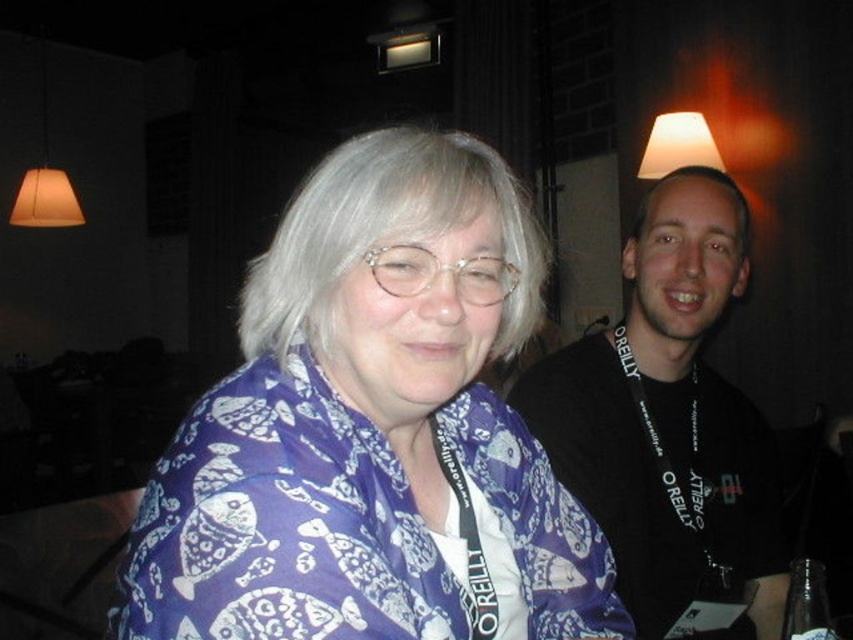
Is purple printed scarf at center below wooden table at lower left?

No, purple printed scarf at center is not below wooden table at lower left.

Can you confirm if purple printed scarf at center is bigger than wooden table at lower left?

Indeed, purple printed scarf at center has a larger size compared to wooden table at lower left.

Which is behind, point (495, 589) or point (24, 572)?

The point (24, 572) is behind.

Locate an element on the screen. This screenshot has height=640, width=853. purple printed scarf at center is located at coordinates (373, 429).

Consider the image. Can you confirm if black lanyard at right is positioned to the left of matte white lampshade at upper center?

Indeed, black lanyard at right is positioned on the left side of matte white lampshade at upper center.

Is point (730, 243) positioned after point (643, 177)?

No, (730, 243) is in front of (643, 177).

Describe the element at coordinates (669, 420) in the screenshot. The height and width of the screenshot is (640, 853). I see `black lanyard at right` at that location.

Where is `black lanyard at right`? The height and width of the screenshot is (640, 853). black lanyard at right is located at coordinates (669, 420).

Does point (10, 211) lie behind point (660, 173)?

Yes, point (10, 211) is farther from viewer.

Does matte orange lampshade at upper left have a greater height compared to matte white lampshade at upper center?

Correct, matte orange lampshade at upper left is much taller as matte white lampshade at upper center.

You are a GUI agent. You are given a task and a screenshot of the screen. Output one action in this format:
    pyautogui.click(x=<x>, y=<y>)
    Task: Click on the matte orange lampshade at upper left
    The image size is (853, 640).
    Given the screenshot: What is the action you would take?
    pyautogui.click(x=45, y=177)